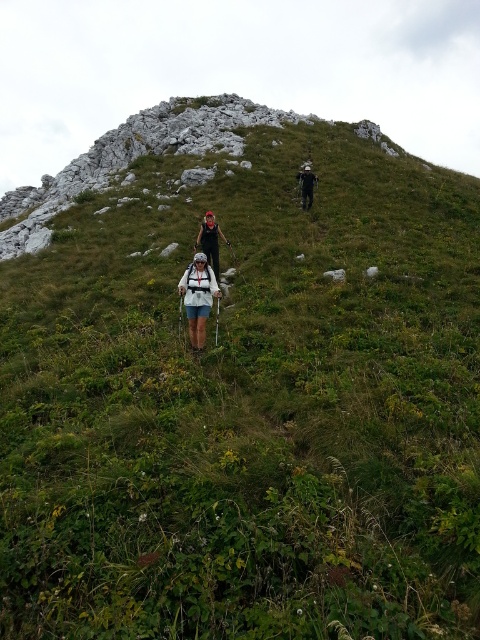
Can you confirm if black fabric backpack at center is taller than dark gray fabric backpack at upper center?

No.

From the picture: Does black fabric backpack at center have a smaller size compared to dark gray fabric backpack at upper center?

Yes.

Image resolution: width=480 pixels, height=640 pixels. I want to click on black fabric backpack at center, so click(210, 241).

Does white matte backpack at center appear under dark gray fabric backpack at upper center?

Correct, white matte backpack at center is located below dark gray fabric backpack at upper center.

This screenshot has width=480, height=640. Find the location of `white matte backpack at center`. white matte backpack at center is located at coordinates (197, 298).

Locate an element on the screen. white matte backpack at center is located at coordinates (197, 298).

Looking at this image, does white matte backpack at center have a lesser width compared to black fabric backpack at center?

No.

Between white matte backpack at center and black fabric backpack at center, which one has more height?

white matte backpack at center is taller.

Image resolution: width=480 pixels, height=640 pixels. Identify the location of white matte backpack at center. (197, 298).

Identify the location of white matte backpack at center. (197, 298).